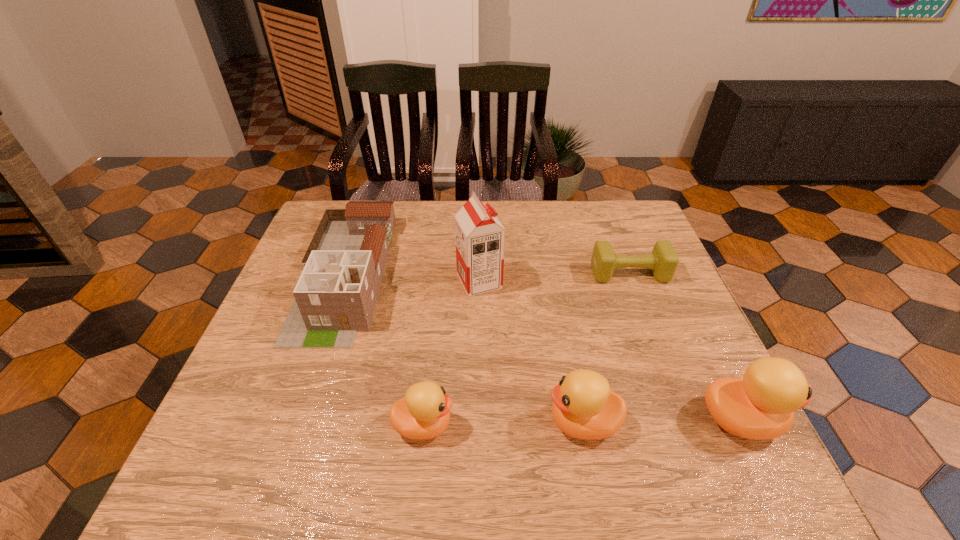
You are a GUI agent. You are given a task and a screenshot of the screen. Output one action in this format:
    pyautogui.click(x=<x>, y=<y>)
    Task: Click on the object present at the near right corner
    This screenshot has height=540, width=960.
    Given the screenshot: What is the action you would take?
    pyautogui.click(x=761, y=405)

Identify the location of free region at the far edge of the desktop. Image resolution: width=960 pixels, height=540 pixels. (399, 218).

Locate an element on the screen. This screenshot has width=960, height=540. blank space at the near edge is located at coordinates (636, 407).

Locate an element on the screen. free location at the right edge is located at coordinates (638, 275).

The height and width of the screenshot is (540, 960). Identify the location of vacant space at the far right corner of the desktop. (605, 238).

You are a GUI agent. You are given a task and a screenshot of the screen. Output one action in this format:
    pyautogui.click(x=<x>, y=<y>)
    Task: Click on the vacant point located between the shortest object and the rightmost duckling
    
    Given the screenshot: What is the action you would take?
    pyautogui.click(x=685, y=347)

What are the coordinates of `free space between the dumbbell and the second shortest duckling` in the screenshot? It's located at (606, 348).

I want to click on vacant point located between the tallest object and the leftmost object, so click(412, 278).

Identify the location of vacant space that is in between the leftmost object and the third shortest object. The image size is (960, 540). (464, 349).

The image size is (960, 540). I want to click on free space between the dumbbell and the tallest object, so click(x=555, y=278).